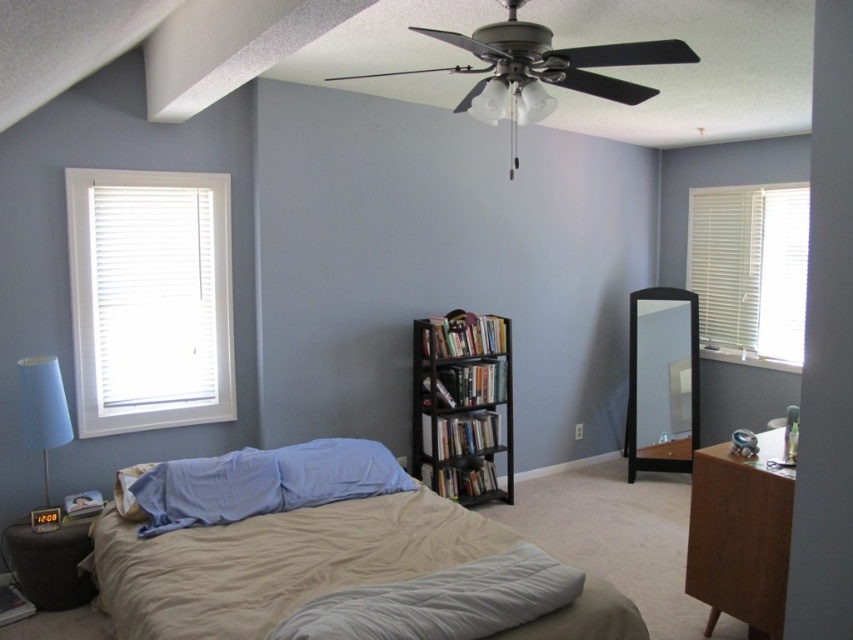
In the scene shown: Does blue fabric pillow at center have a greater height compared to white glass ceiling fan at upper center?

Indeed, blue fabric pillow at center has a greater height compared to white glass ceiling fan at upper center.

Looking at this image, between blue fabric pillow at center and white glass ceiling fan at upper center, which one has more height?

blue fabric pillow at center

This screenshot has width=853, height=640. I want to click on blue fabric pillow at center, so click(263, 483).

Can you confirm if beige fabric bed at center is smaller than white matte window at left?

No, beige fabric bed at center is not smaller than white matte window at left.

Between point (235, 620) and point (163, 204), which one is positioned behind?

Positioned behind is point (163, 204).

You are a GUI agent. You are given a task and a screenshot of the screen. Output one action in this format:
    pyautogui.click(x=<x>, y=<y>)
    Task: Click on the beige fabric bed at center
    
    Given the screenshot: What is the action you would take?
    pyautogui.click(x=276, y=563)

You are a GUI agent. You are given a task and a screenshot of the screen. Output one action in this format:
    pyautogui.click(x=<x>, y=<y>)
    Task: Click on the beige fabric bed at center
    The width and height of the screenshot is (853, 640).
    Given the screenshot: What is the action you would take?
    pyautogui.click(x=276, y=563)

Which is behind, point (106, 262) or point (224, 504)?

Positioned behind is point (106, 262).

What do you see at coordinates (149, 298) in the screenshot?
I see `white matte window at left` at bounding box center [149, 298].

Find the location of a particular element. The image size is (853, 640). white matte window at left is located at coordinates (149, 298).